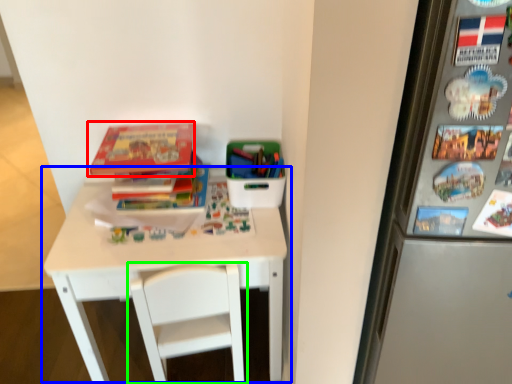
Question: Based on their relative distances, which object is nearer to book (highlighted by a red box)? Choose from table (highlighted by a blue box) and chair (highlighted by a green box).

Choices:
 (A) table
 (B) chair

Answer: (A)